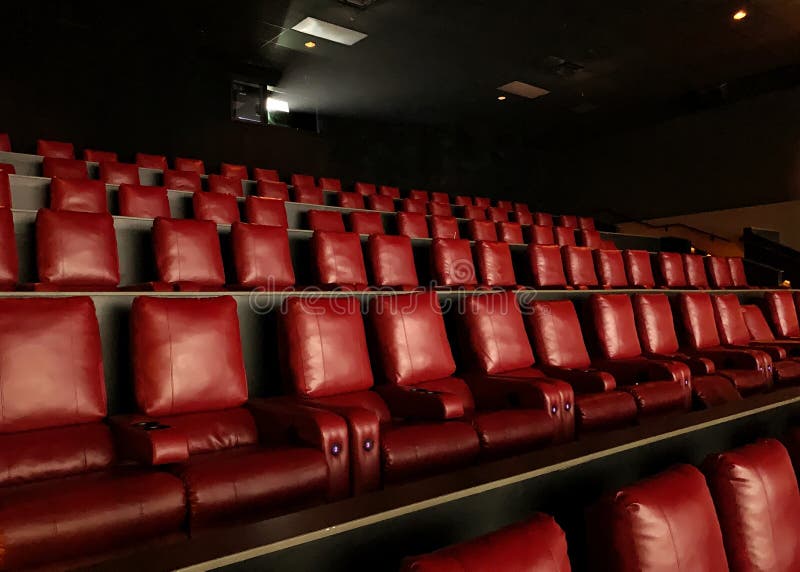
Locate an element on the screen. The image size is (800, 572). rows of chairs is located at coordinates (28, 157), (25, 182), (29, 212), (109, 296), (380, 525).